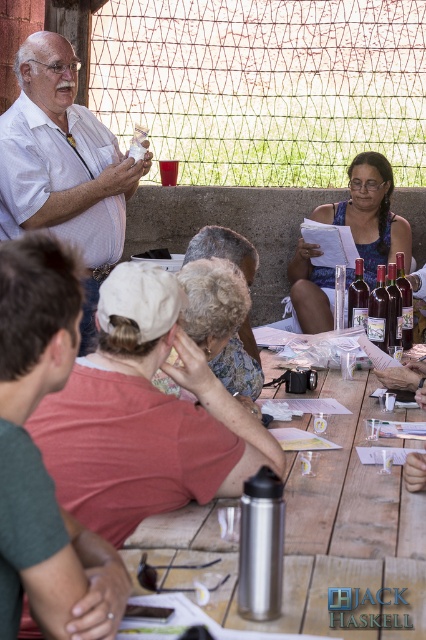
Question: Does blue printed dress at center have a smaller size compared to gray fabric cap at center?

Choices:
 (A) no
 (B) yes

Answer: (A)

Question: Does white fabric cap at upper left have a lesser width compared to dark brown glass bottles at center?

Choices:
 (A) no
 (B) yes

Answer: (A)

Question: Estimate the real-world distances between objects in this image. Which object is farther from the gray fabric cap at center?

Choices:
 (A) dark brown glass bottles at center
 (B) dark red glass bottle at center

Answer: (A)

Question: Can you confirm if wooden table at center is positioned to the left of blue printed dress at center?

Choices:
 (A) no
 (B) yes

Answer: (B)

Question: Which point is farther from the camera taking this photo?

Choices:
 (A) (17, 314)
 (B) (298, 538)
 (C) (330, 268)

Answer: (C)

Question: Which of the following is the closest to the observer?

Choices:
 (A) (155, 481)
 (B) (356, 307)
 (C) (92, 257)
 (D) (379, 337)

Answer: (A)